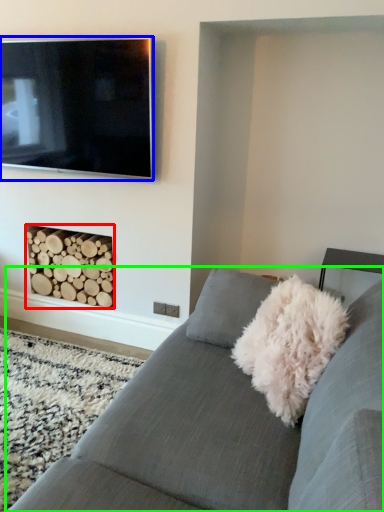
Question: Based on their relative distances, which object is farther from fireplace (highlighted by a red box)? Choose from television (highlighted by a blue box) and studio couch (highlighted by a green box).

Choices:
 (A) television
 (B) studio couch

Answer: (B)